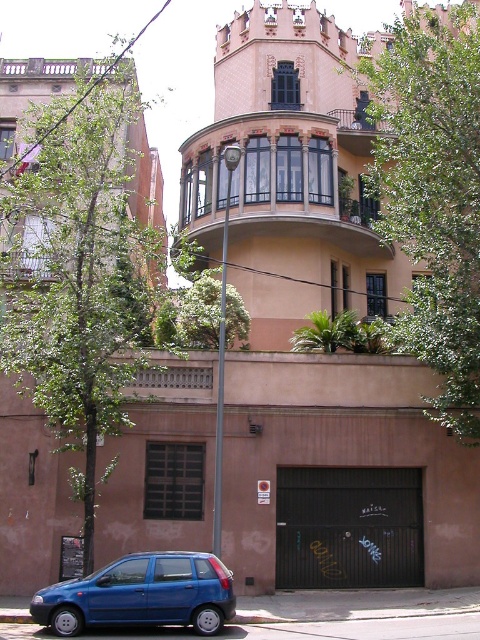
You are standing in front of the residential building and notice the green leafy tree at upper left and the wooden balcony at upper center. Which object is positioned closer to you?

The green leafy tree at upper left is closer to the viewer than the wooden balcony at upper center.

You are standing at the entrance of the building and want to locate the matte black balcony at center. According to the coordinates provided, where should you look relative to the building?

The matte black balcony at center is located at point coordinates 0.284 on the x axis and 0.571 on the y axis relative to the building.